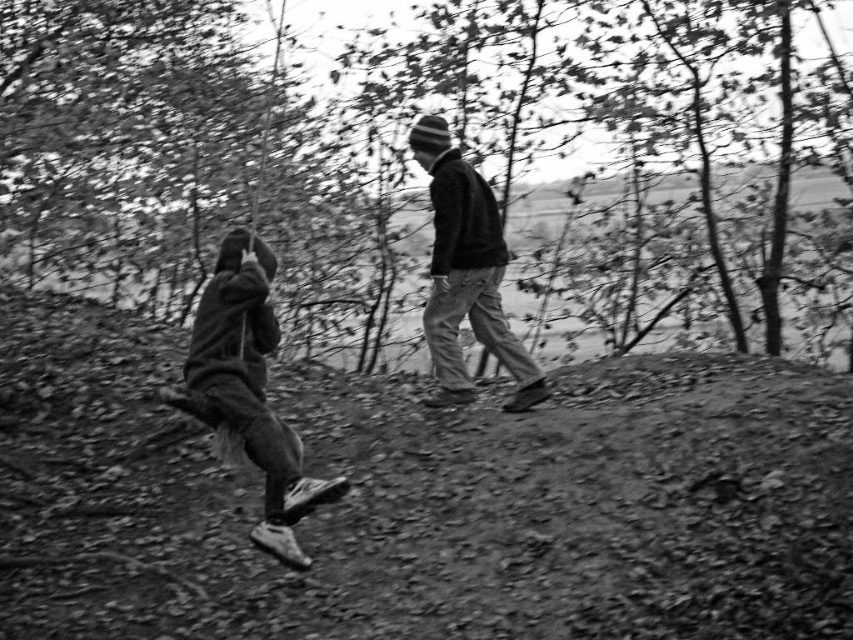
You are standing at the point closer to the camera in this image. There are two points marked in the scene, point 1 at coordinates (630, 109) and point 2 at (199, 356). If you want to move towards the person in the background, which point should you head towards?

You should head towards point 2 at coordinates (199, 356) because it is farther from the viewer compared to point 1 at (630, 109), which aligns with the direction of the background person.

You are a photographer trying to capture both the dark gray fleece jacket at lower left and the knit cap at center in a single frame. Based on their positions, which object should you focus on first to ensure both are in focus?

The dark gray fleece jacket at lower left is shorter than the knit cap at center, so focusing on the knit cap at center first would help ensure both are in focus since it is farther away and requires a deeper depth of field.